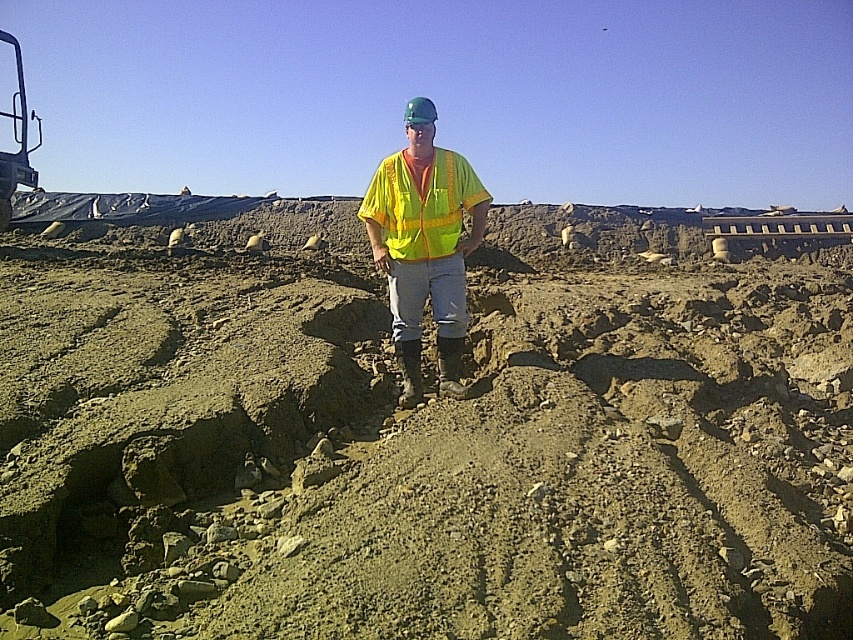
You are a delivery drone operator. You need to fly a drone from point A to point B. Point A is at coordinate point (68, 321) and point B is at coordinate point (410, 300). According to the scene, which point is closer to the construction worker wearing a teal hard hat?

Point (410, 300) is closer to the construction worker wearing a teal hard hat because it is in front of point (68, 321), which is behind it.

You are a construction worker with a 6.5 feet long safety rope. You need to cross from your current position to the dull brown dirt at center. Can you safely make the jump using the rope?

The distance between you and the dull brown dirt at center is 7.31 feet. Since your rope is 6.5 feet long, it is shorter than the required distance. Therefore, you cannot safely jump using the rope.

You are a safety inspector at the construction site. You need to ensure that the yellow reflective vest at center is visible to all workers. Considering the dull brown dirt at center, is the vest positioned in a way that it would be easily seen from above?

The dull brown dirt at center is above the yellow reflective vest at center, so the vest is positioned below the dirt. This might make it harder to see the vest from above because the dirt could block the view.